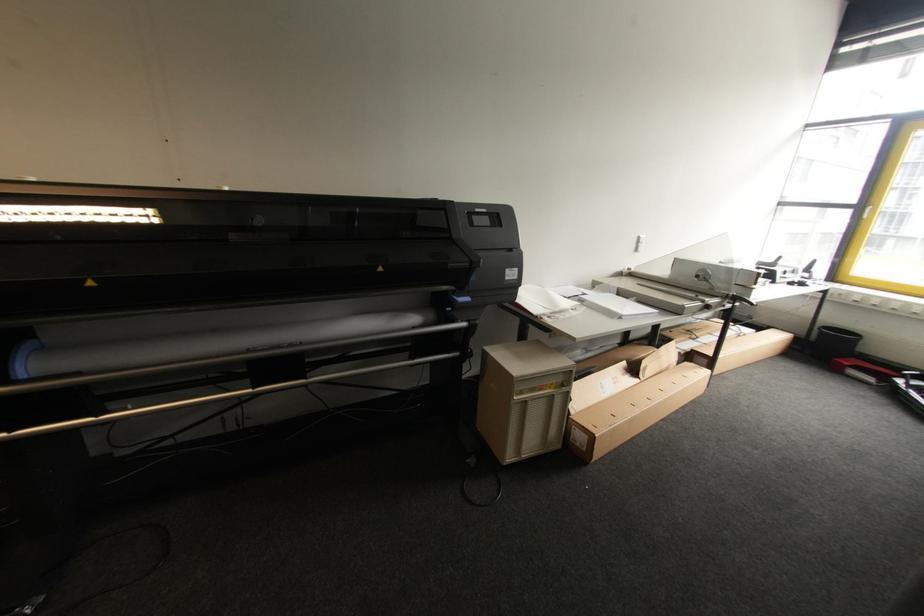
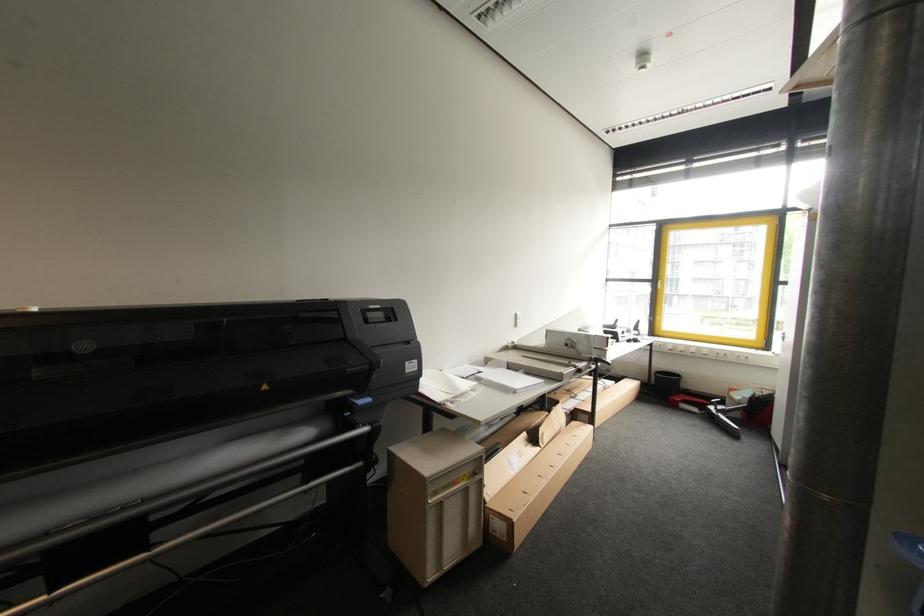
In the second image, find the point that corresponds to [470,300] in the first image.

(371, 400)